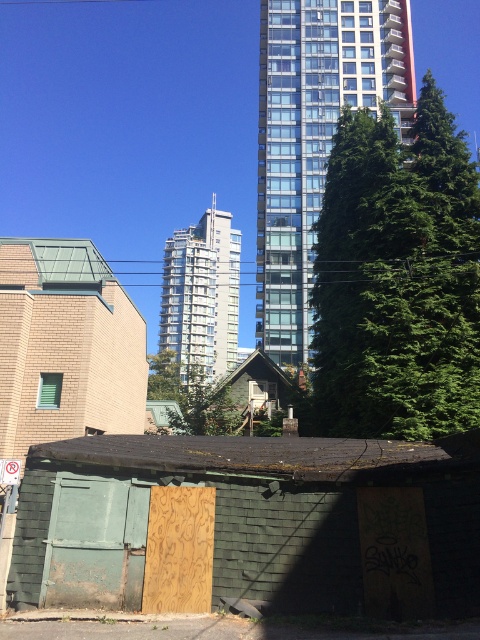
You are standing in the urban scene and want to take a photo of the green shingled shed at lower left and the glassy concrete building at center. Which object is positioned to the right of the other?

The green shingled shed at lower left is to the right of the glassy concrete building at center.

From the picture: You are standing in the middle of the urban scene looking towards the glassy concrete building at upper center. Which direction should you turn to locate the green shingled shed at lower left?

The green shingled shed at lower left is to the left of the glassy concrete building at upper center, so you should turn to your left to locate it.